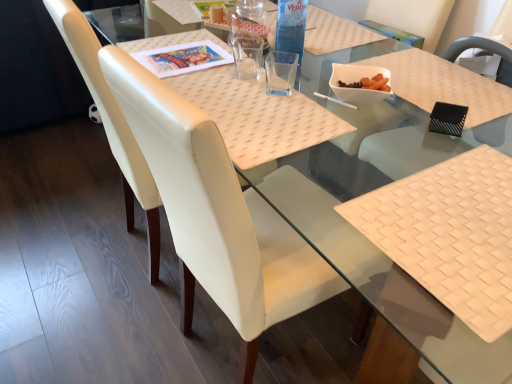
The width and height of the screenshot is (512, 384). Find the location of `unoccupied area in front of white leather chair at left, which is the 3th chair in right-to-left order`. unoccupied area in front of white leather chair at left, which is the 3th chair in right-to-left order is located at coordinates (101, 330).